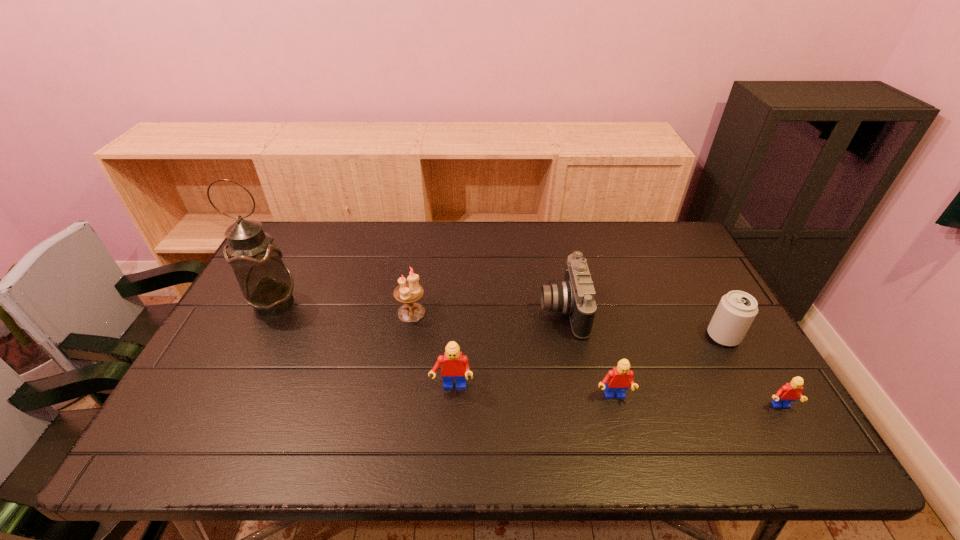
Please point a free position for a Lego on the left. Please provide its 2D coordinates. Your answer should be formatted as a tuple, i.e. [(x, y)], where the tuple contains the x and y coordinates of a point satisfying the conditions above.

[(297, 379)]